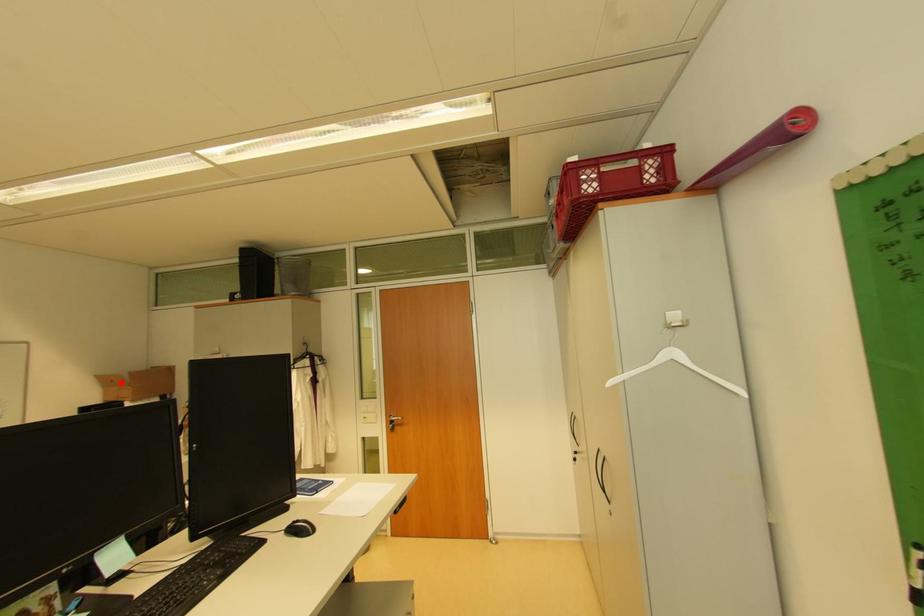
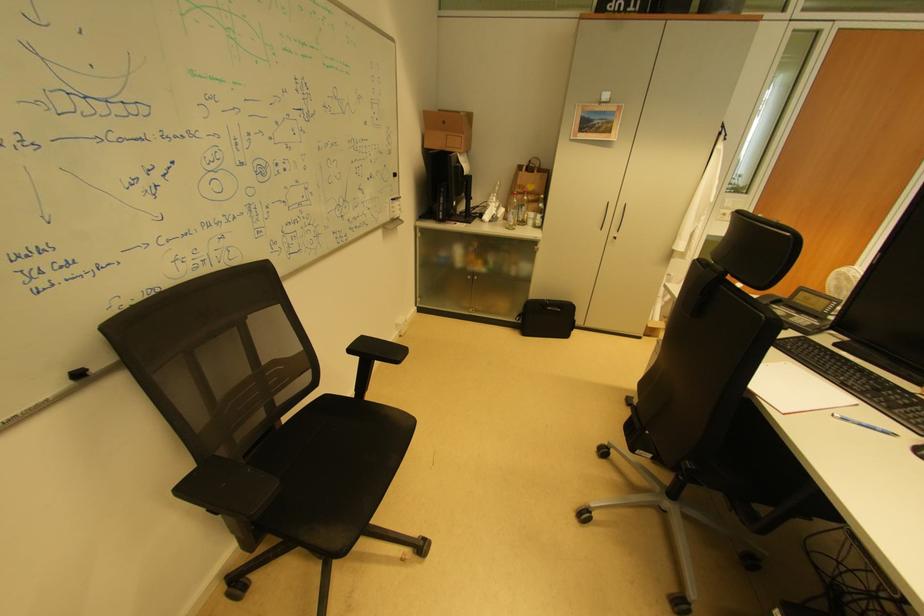
Question: A red point is marked in image1. In image2, is the corresponding 3D point closer to the camera or farther? Reply with the corresponding letter.

Choices:
 (A) The corresponding 3D point is closer.
 (B) The corresponding 3D point is farther.

Answer: (A)